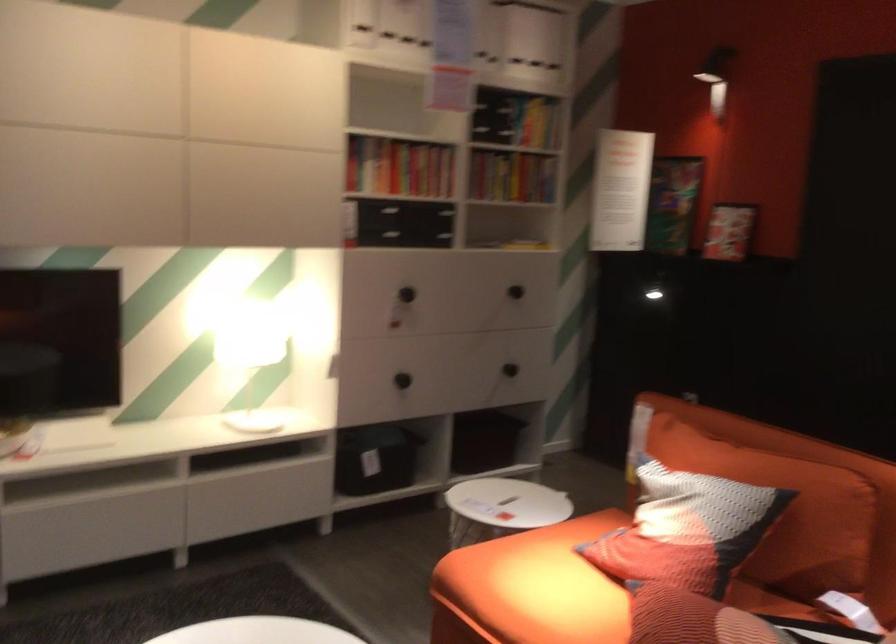
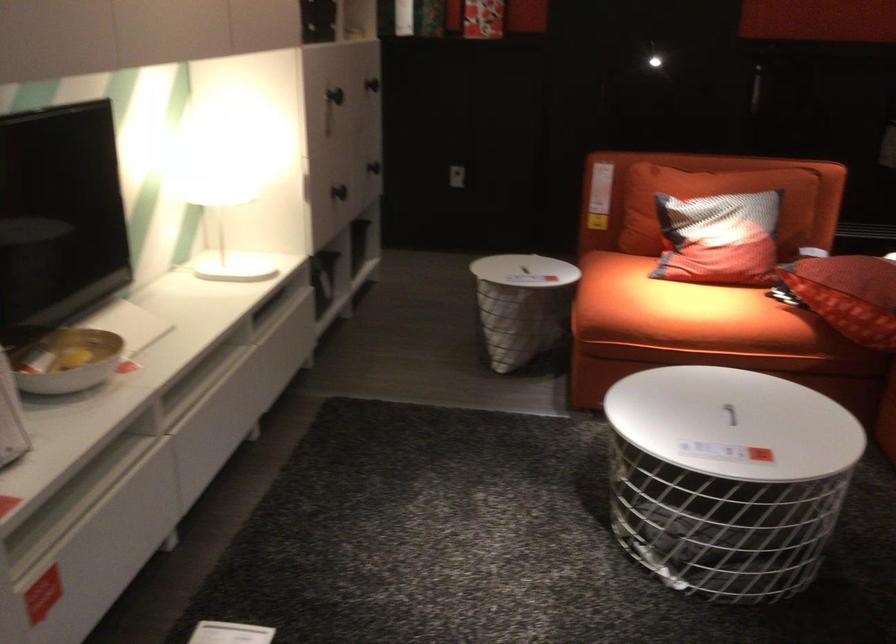
Where in the second image is the point corresponding to point (122, 487) from the first image?

(200, 381)